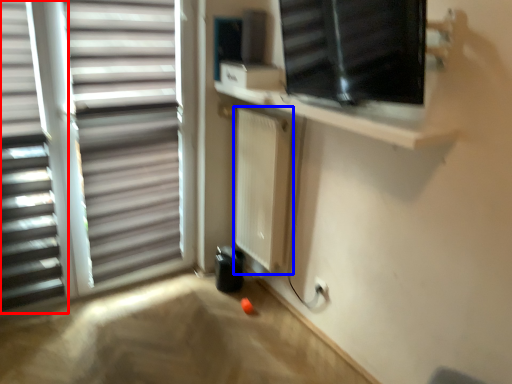
Question: Which object appears closest to the camera in this image, window blind (highlighted by a red box) or radiator (highlighted by a blue box)?

Choices:
 (A) window blind
 (B) radiator

Answer: (A)